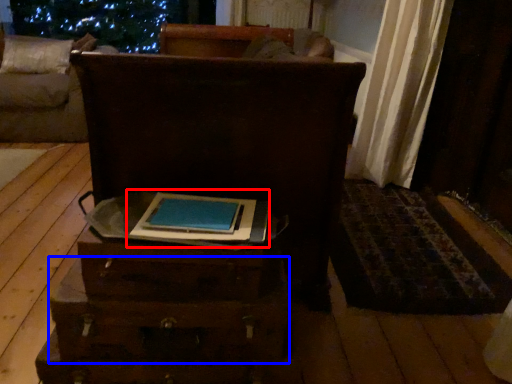
Question: Which object is closer to the camera taking this photo, book (highlighted by a red box) or drawer (highlighted by a blue box)?

Choices:
 (A) book
 (B) drawer

Answer: (A)